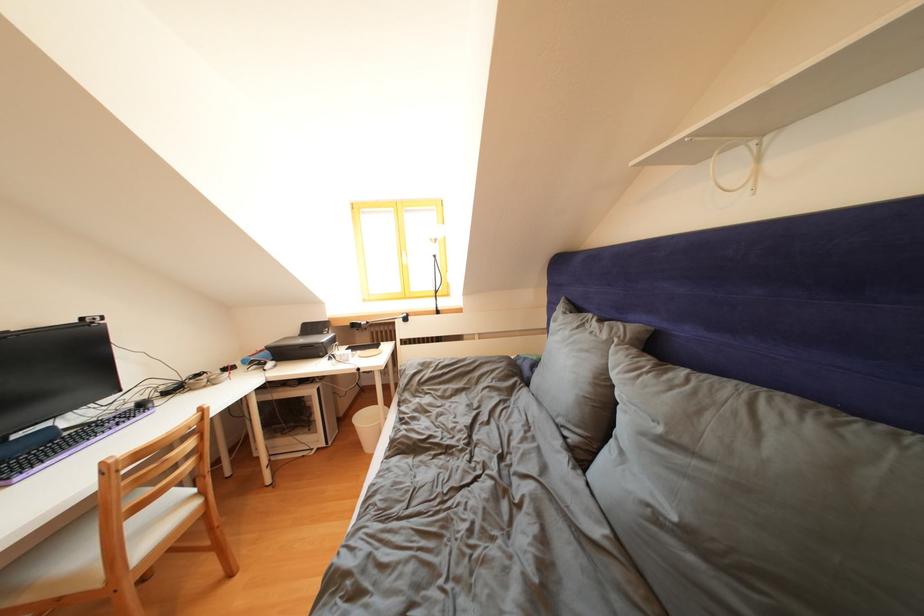
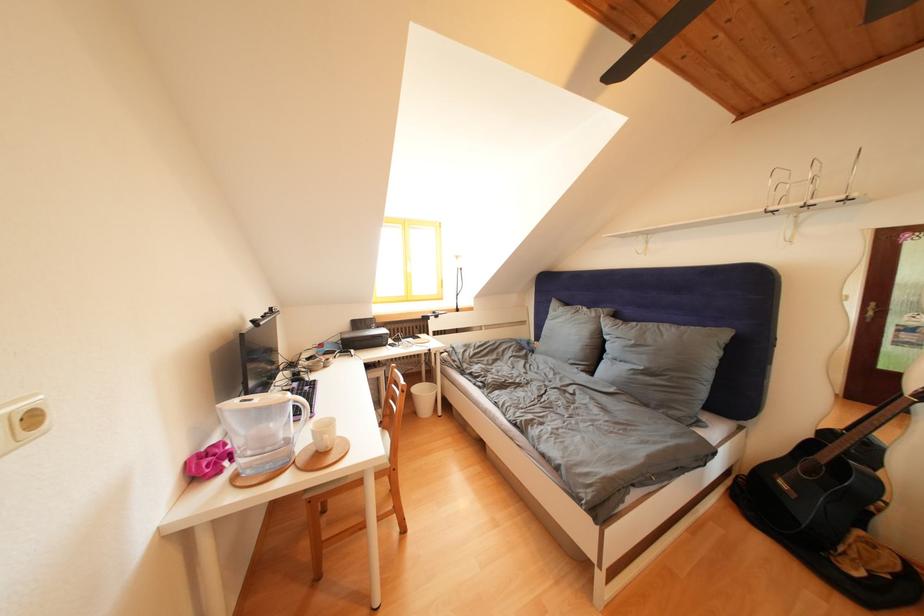
Find the pixel in the second image that matches [612,341] in the first image.

(602, 320)